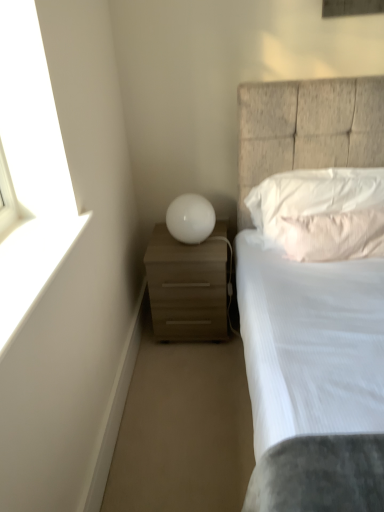
Question: From a real-world perspective, is white matte window sill at upper left on top of white glossy sphere at center?

Choices:
 (A) yes
 (B) no

Answer: (A)

Question: Is white matte window sill at upper left in contact with white glossy sphere at center?

Choices:
 (A) no
 (B) yes

Answer: (A)

Question: Does white matte window sill at upper left have a larger size compared to white glossy sphere at center?

Choices:
 (A) no
 (B) yes

Answer: (A)

Question: Is white matte window sill at upper left to the left of white glossy sphere at center from the viewer's perspective?

Choices:
 (A) yes
 (B) no

Answer: (A)

Question: From a real-world perspective, is white matte window sill at upper left below white glossy sphere at center?

Choices:
 (A) yes
 (B) no

Answer: (B)

Question: From the image's perspective, would you say white matte window sill at upper left is shown under white glossy sphere at center?

Choices:
 (A) yes
 (B) no

Answer: (A)

Question: Considering the relative sizes of white glossy sphere at center and white matte window sill at upper left in the image provided, is white glossy sphere at center shorter than white matte window sill at upper left?

Choices:
 (A) yes
 (B) no

Answer: (B)

Question: From a real-world perspective, is white glossy sphere at center beneath white matte window sill at upper left?

Choices:
 (A) no
 (B) yes

Answer: (B)

Question: Is there a large distance between white glossy sphere at center and white matte window sill at upper left?

Choices:
 (A) yes
 (B) no

Answer: (B)

Question: Does white glossy sphere at center have a lesser width compared to white matte window sill at upper left?

Choices:
 (A) no
 (B) yes

Answer: (B)

Question: Considering the relative positions of white glossy sphere at center and white matte window sill at upper left in the image provided, is white glossy sphere at center to the right of white matte window sill at upper left from the viewer's perspective?

Choices:
 (A) yes
 (B) no

Answer: (A)

Question: Is white glossy sphere at center positioned behind white matte window sill at upper left?

Choices:
 (A) no
 (B) yes

Answer: (B)

Question: Is white matte window sill at upper left touching white soft pillow at upper right, the 1th pillow when ordered from top to bottom?

Choices:
 (A) yes
 (B) no

Answer: (B)